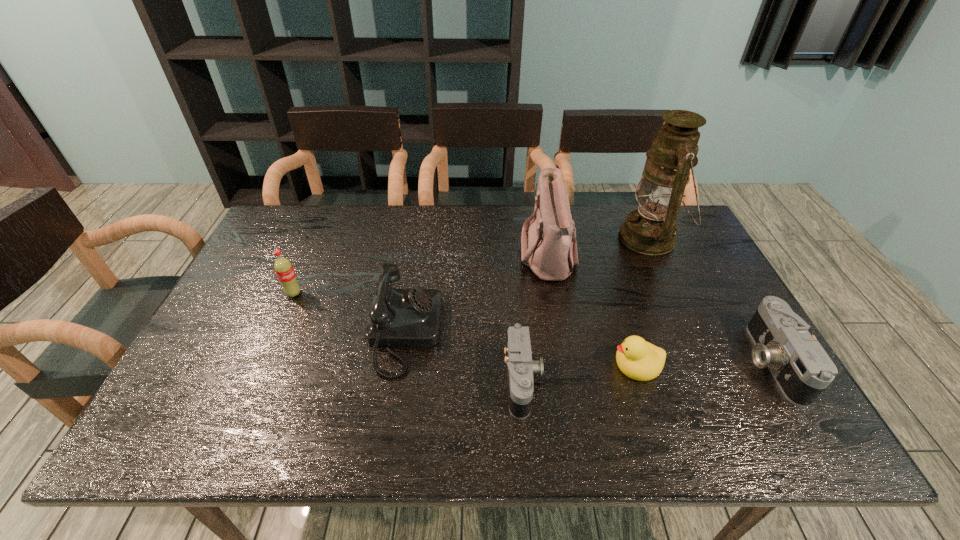
The height and width of the screenshot is (540, 960). Find the location of `free spot between the shorter camera and the telephone`. free spot between the shorter camera and the telephone is located at coordinates (464, 357).

Locate an element on the screen. free space between the right camera and the soda is located at coordinates (533, 328).

This screenshot has width=960, height=540. What are the coordinates of `unoccupied position between the oil lamp and the soda` in the screenshot? It's located at (471, 266).

Identify the location of empty location between the duckling and the soda. (466, 329).

The height and width of the screenshot is (540, 960). I want to click on the sixth closest object to the fifth object from left to right, so [x=283, y=267].

Identify which object is located as the sixth nearest to the sixth object from left to right. Please provide its 2D coordinates. Your answer should be formatted as a tuple, i.e. [(x, y)], where the tuple contains the x and y coordinates of a point satisfying the conditions above.

[(283, 267)]